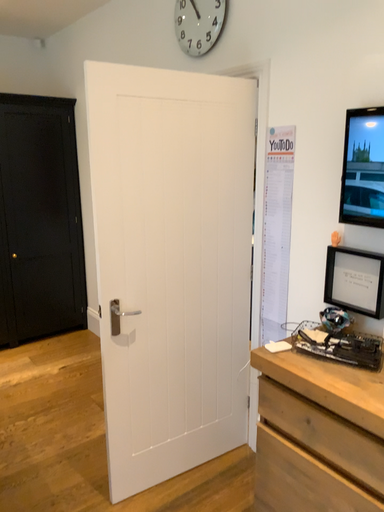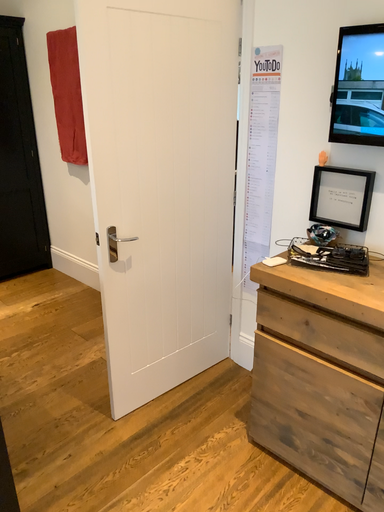
Question: Which way did the camera rotate in the video?

Choices:
 (A) rotated left
 (B) rotated right

Answer: (B)